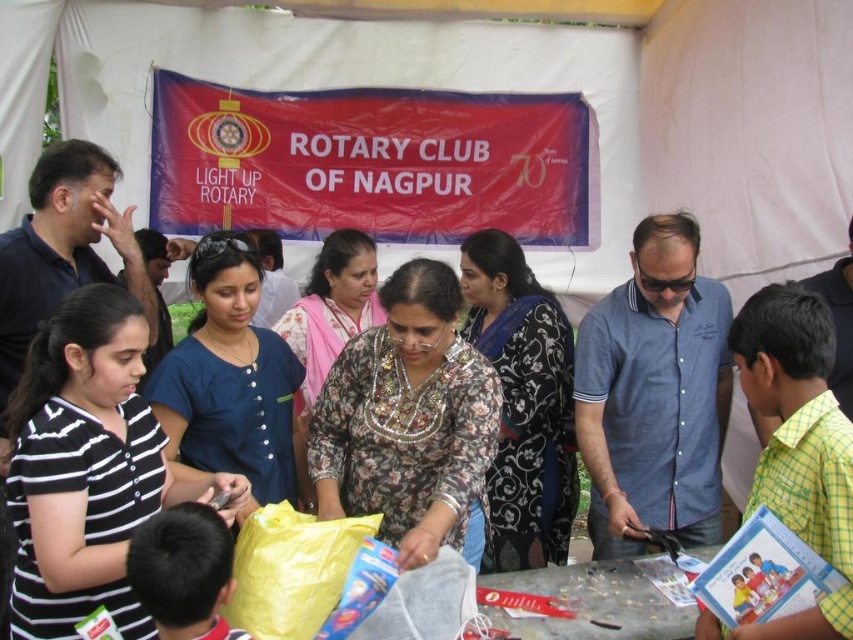
You are a photographer at the Rotary Club of Nagpur event. You want to capture a photo that includes both the floral printed dress at center and the blue fabric shirt at center. Which object should you focus on first to ensure both are in sharp focus?

The floral printed dress at center is closer to the viewer than the blue fabric shirt at center. To ensure both are in sharp focus, you should focus on the floral printed dress at center first.

You are attending the Rotary Club of Nagpur event and notice two attendees wearing a black striped shirt at lower left and a black floral dress at center. Which clothing item is smaller in size?

The black striped shirt at lower left is smaller in size compared to the black floral dress at center.